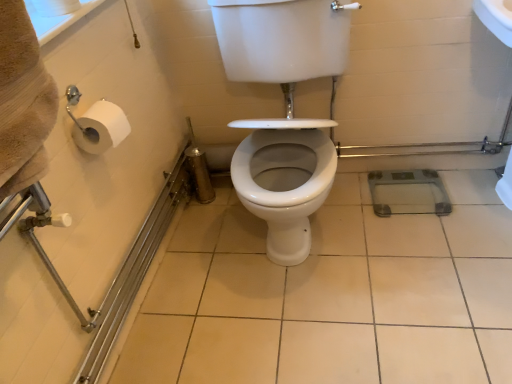
Question: Relative to white glossy ceramic tile at center, is white glossy toilet seat at center in front or behind?

Choices:
 (A) front
 (B) behind

Answer: (A)

Question: Is white glossy toilet seat at center wider or thinner than white glossy ceramic tile at center?

Choices:
 (A) wide
 (B) thin

Answer: (B)

Question: Considering the positions of point (334, 71) and point (325, 261), is point (334, 71) closer or farther from the camera than point (325, 261)?

Choices:
 (A) closer
 (B) farther

Answer: (A)

Question: Is white glossy ceramic tile at center spatially inside white glossy toilet seat at center, or outside of it?

Choices:
 (A) inside
 (B) outside

Answer: (B)

Question: Is white glossy ceramic tile at center bigger or smaller than white glossy toilet seat at center?

Choices:
 (A) big
 (B) small

Answer: (B)

Question: From their relative heights in the image, would you say white glossy ceramic tile at center is taller or shorter than white glossy toilet seat at center?

Choices:
 (A) tall
 (B) short

Answer: (B)

Question: In the image, is white glossy ceramic tile at center positioned in front of or behind white glossy toilet seat at center?

Choices:
 (A) behind
 (B) front

Answer: (A)